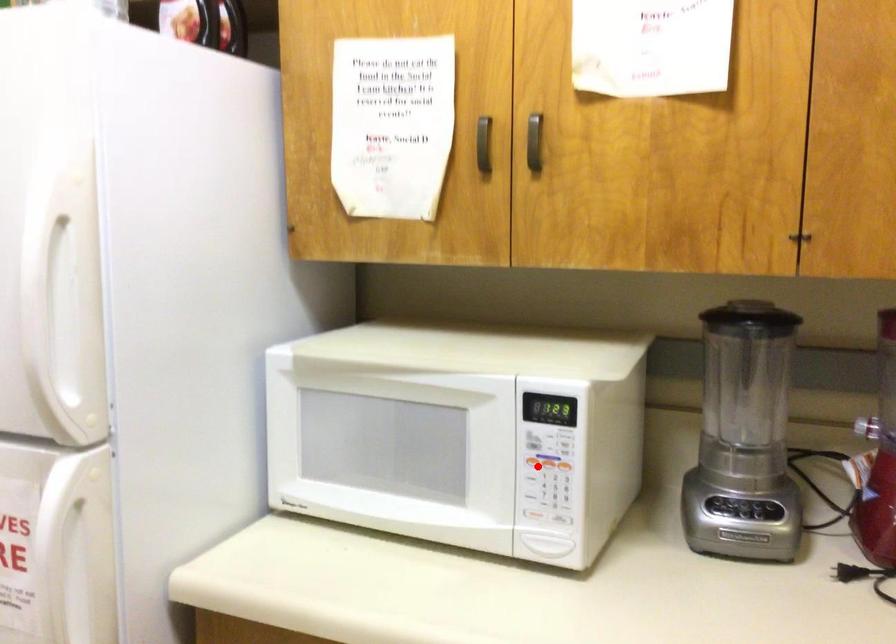
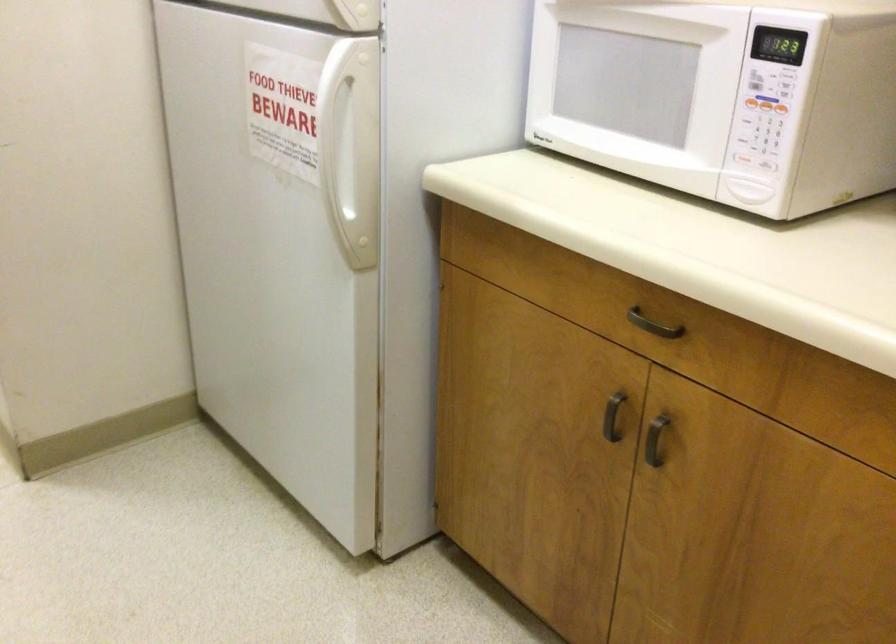
Where in the second image is the point corresponding to the highlighted location from the first image?

(752, 102)